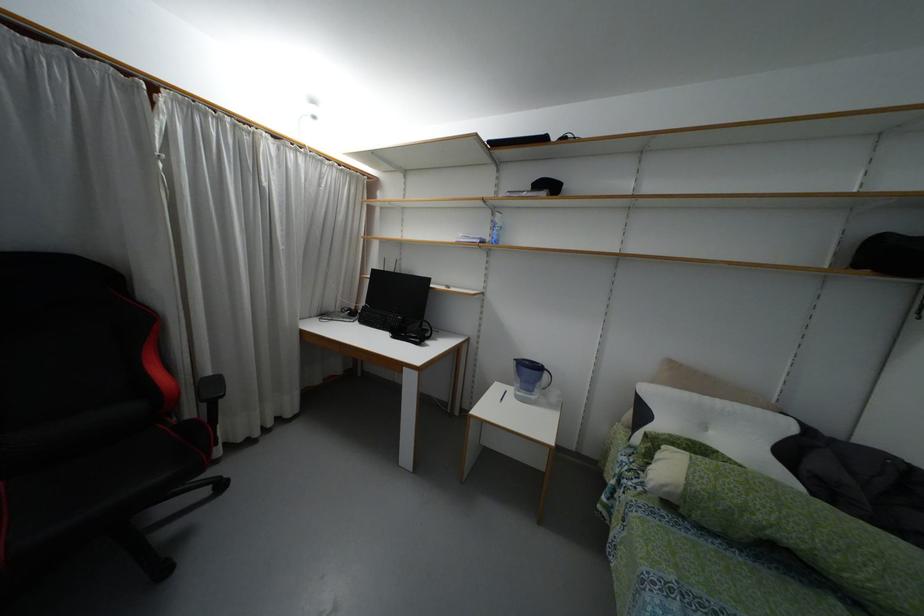
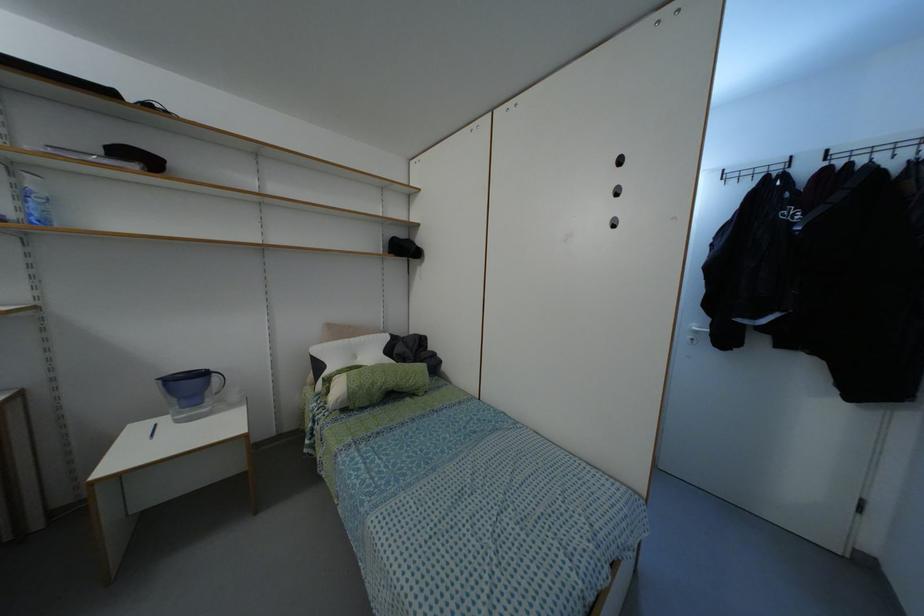
Where in the second image is the point corresponding to [695,395] from the first image?

(345, 339)